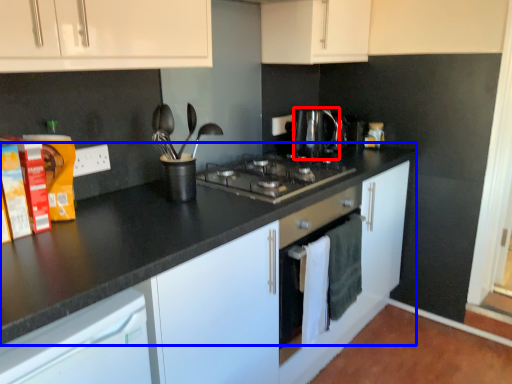
Question: Which object is closer to the camera taking this photo, kitchen appliance (highlighted by a red box) or counter top (highlighted by a blue box)?

Choices:
 (A) kitchen appliance
 (B) counter top

Answer: (B)